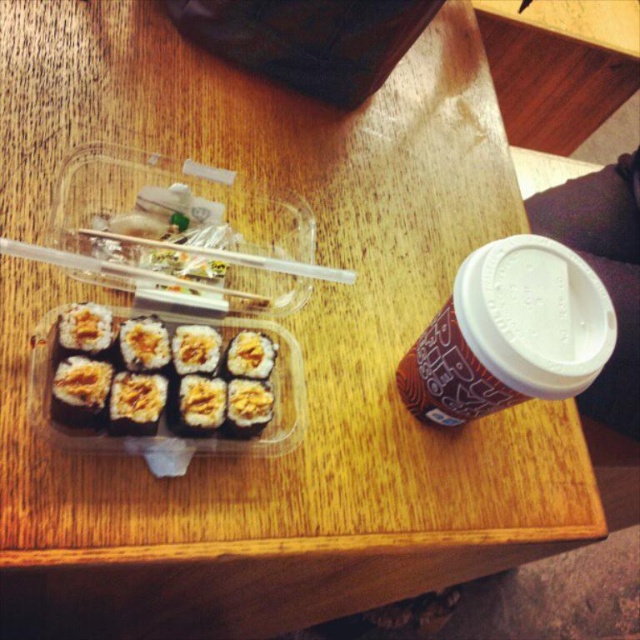
Question: Is matte brown cup at right above sushi at left?

Choices:
 (A) no
 (B) yes

Answer: (B)

Question: Which of the following is the farthest from the observer?

Choices:
 (A) (225, 349)
 (B) (497, 273)

Answer: (A)

Question: Which of the following is the farthest from the observer?

Choices:
 (A) (522, 308)
 (B) (99, 234)
 (C) (248, 419)

Answer: (B)

Question: Is matte brown cup at right to the left of clear plastic chopsticks at upper center from the viewer's perspective?

Choices:
 (A) no
 (B) yes

Answer: (A)

Question: Which object is farther from the camera taking this photo?

Choices:
 (A) matte brown cup at right
 (B) sushi at left
 (C) clear plastic chopsticks at upper center

Answer: (C)

Question: Does matte brown cup at right appear on the left side of sushi at left?

Choices:
 (A) no
 (B) yes

Answer: (A)